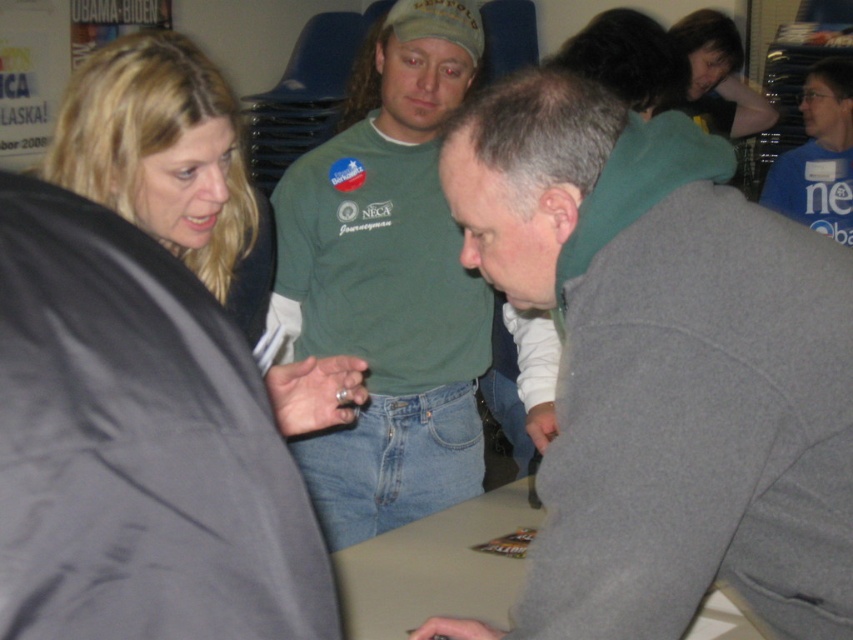
Is gray fleece jacket at center closer to the viewer compared to green cotton shirt at center?

That is True.

Which of these two, gray fleece jacket at center or green cotton shirt at center, stands shorter?

Standing shorter between the two is gray fleece jacket at center.

Identify the location of gray fleece jacket at center. (663, 380).

The width and height of the screenshot is (853, 640). Find the location of `gray fleece jacket at center`. gray fleece jacket at center is located at coordinates (663, 380).

Can you confirm if gray fleece jacket at center is thinner than blue cotton shirt at upper right?

No.

From the picture: Does gray fleece jacket at center have a lesser height compared to blue cotton shirt at upper right?

Indeed, gray fleece jacket at center has a lesser height compared to blue cotton shirt at upper right.

Identify the location of gray fleece jacket at center. The image size is (853, 640). (663, 380).

Based on the photo, is green cotton shirt at center positioned before beige matte table at center?

No.

Can you confirm if green cotton shirt at center is positioned below beige matte table at center?

No.

This screenshot has height=640, width=853. What do you see at coordinates (387, 282) in the screenshot?
I see `green cotton shirt at center` at bounding box center [387, 282].

Locate an element on the screen. green cotton shirt at center is located at coordinates (387, 282).